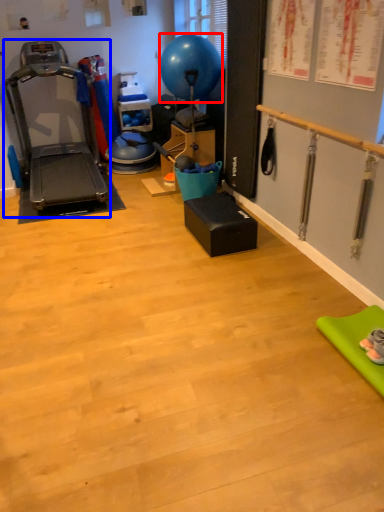
Question: Which point is closer to the camera, balloon (highlighted by a red box) or treadmill (highlighted by a blue box)?

Choices:
 (A) balloon
 (B) treadmill

Answer: (B)